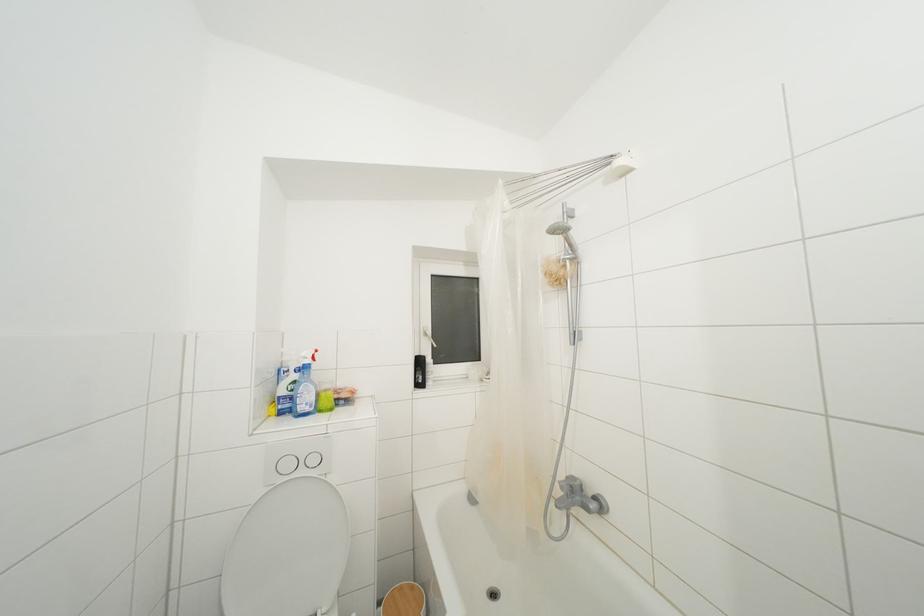
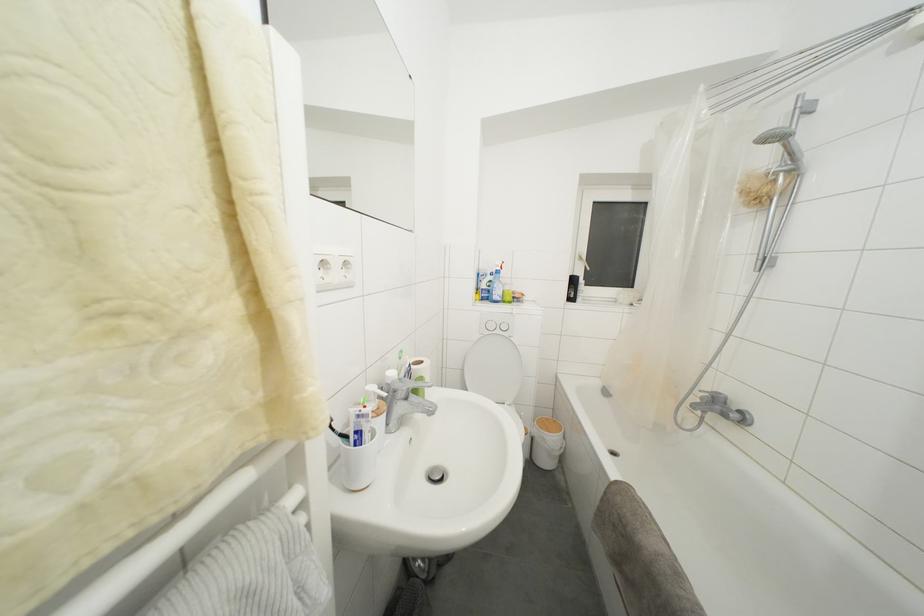
Find the pixel in the second image that matches pixel 347 405 in the first image.

(520, 304)